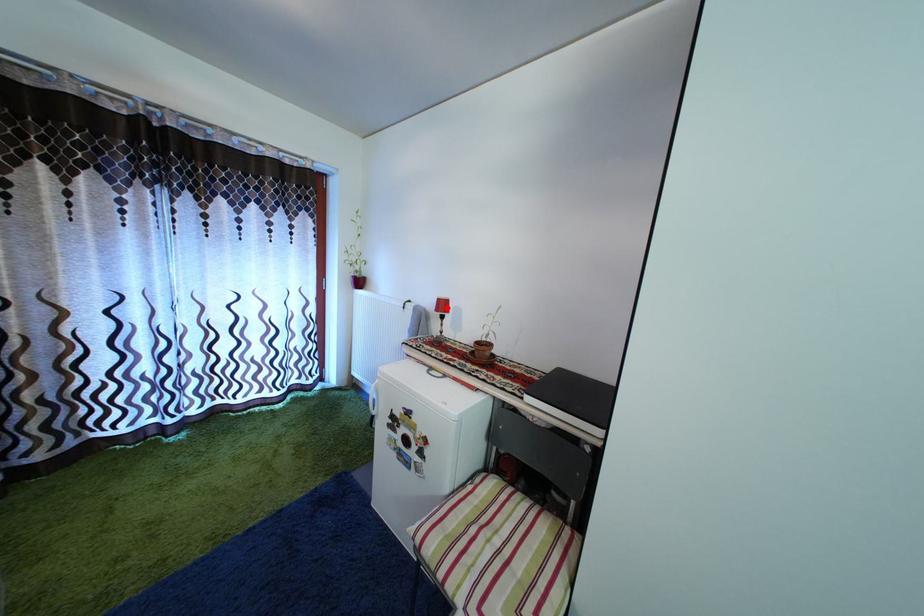
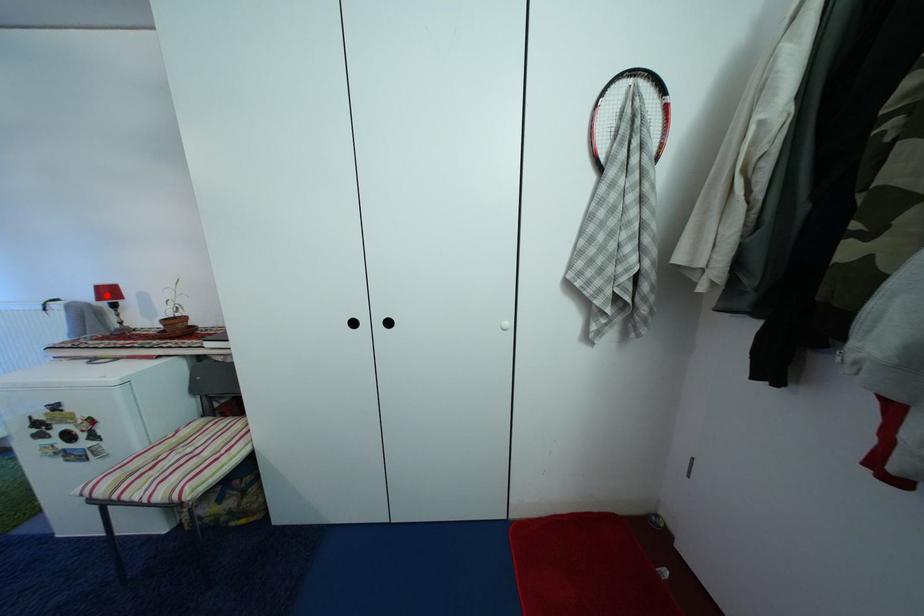
I am providing you with two images of the same scene from different viewpoints. A red point is marked on the first image and another point is marked on the second image. Does the point marked in image1 correspond to the same location as the one in image2?

Yes